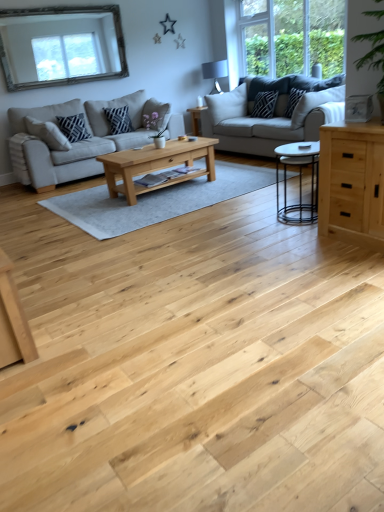
Question: Considering the positions of black metal coffee table at center, the 2th coffee table in the back-to-front sequence, and matte black lampshade at upper center in the image, is black metal coffee table at center, the 2th coffee table in the back-to-front sequence, taller or shorter than matte black lampshade at upper center?

Choices:
 (A) tall
 (B) short

Answer: (B)

Question: Is black metal coffee table at center, the 1th coffee table in the right-to-left sequence, situated inside matte black lampshade at upper center or outside?

Choices:
 (A) outside
 (B) inside

Answer: (A)

Question: Considering the real-world distances, which object is farthest from the light gray fabric couch at center, which appears as the second studio couch when viewed from the left?

Choices:
 (A) black textured pillow at upper right, the second pillow positioned from the right
 (B) natural wood chest of drawers at right
 (C) matte black pillow at center-left, which ranks as the second pillow in left-to-right order
 (D) natural wood coffee table at center, which appears as the first coffee table when viewed from the left
 (E) black metal coffee table at center, which is the first coffee table from front to back

Answer: (B)

Question: Which object is the closest to the black metal coffee table at center, the 2th coffee table in the back-to-front sequence?

Choices:
 (A) matte black pillow at center-left, which ranks as the second pillow in left-to-right order
 (B) natural wood coffee table at center, which appears as the first coffee table when viewed from the left
 (C) clear glass window at upper right
 (D) silver-framed mirror at upper left
 (E) natural wood chest of drawers at right

Answer: (E)